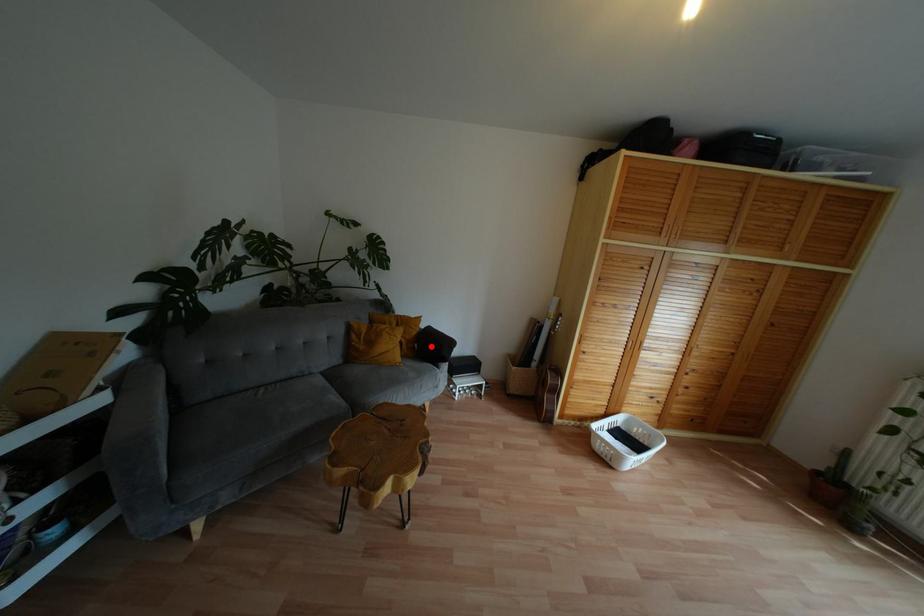
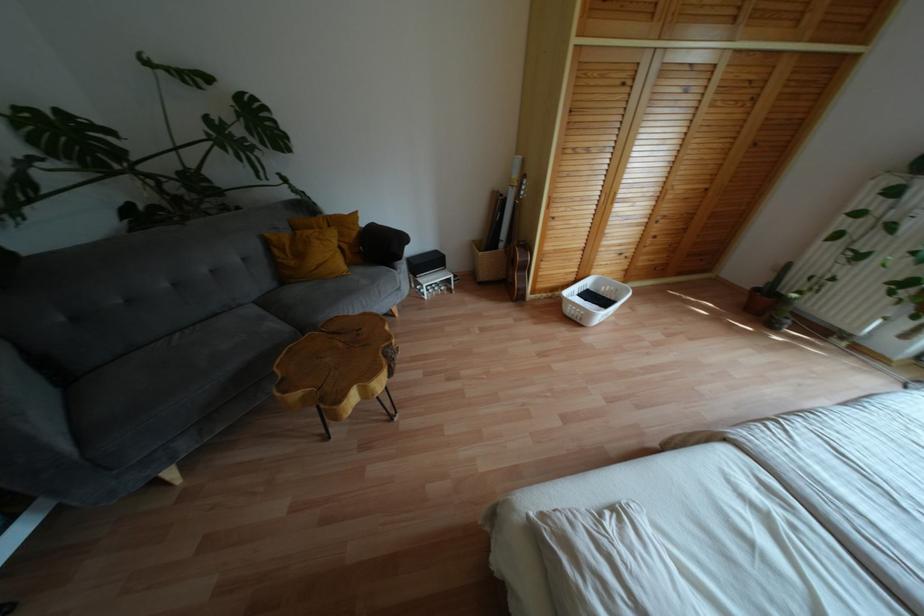
In the second image, find the point that corresponds to the highlighted location in the first image.

(380, 246)